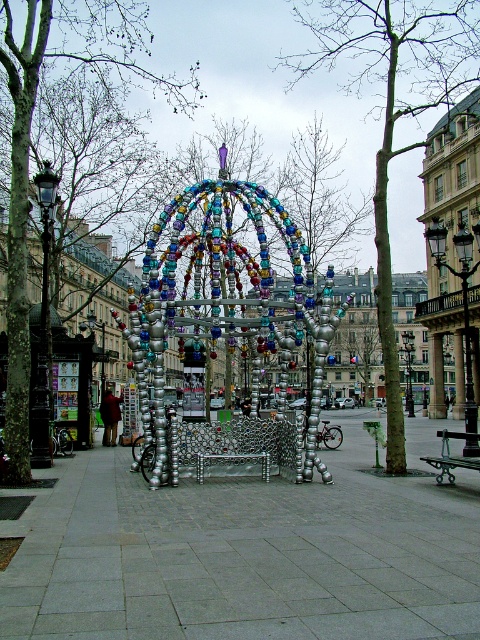
Question: Is smooth bark tree at center below silver metallic sculpture at center?

Choices:
 (A) no
 (B) yes

Answer: (A)

Question: Is metallic beaded structure at center above smooth bark tree at center?

Choices:
 (A) yes
 (B) no

Answer: (B)

Question: Which of the following is the closest to the observer?

Choices:
 (A) (120, 449)
 (B) (322, 1)
 (C) (133, 74)
 (D) (204, 248)

Answer: (D)

Question: Does metallic beaded structure at center have a smaller size compared to silver metallic sculpture at center?

Choices:
 (A) yes
 (B) no

Answer: (A)

Question: Which point appears closest to the camera in this image?

Choices:
 (A) (213, 618)
 (B) (321, 304)

Answer: (A)

Question: Among these points, which one is farthest from the camera?

Choices:
 (A) (15, 74)
 (B) (263, 573)
 (C) (315, 422)

Answer: (A)